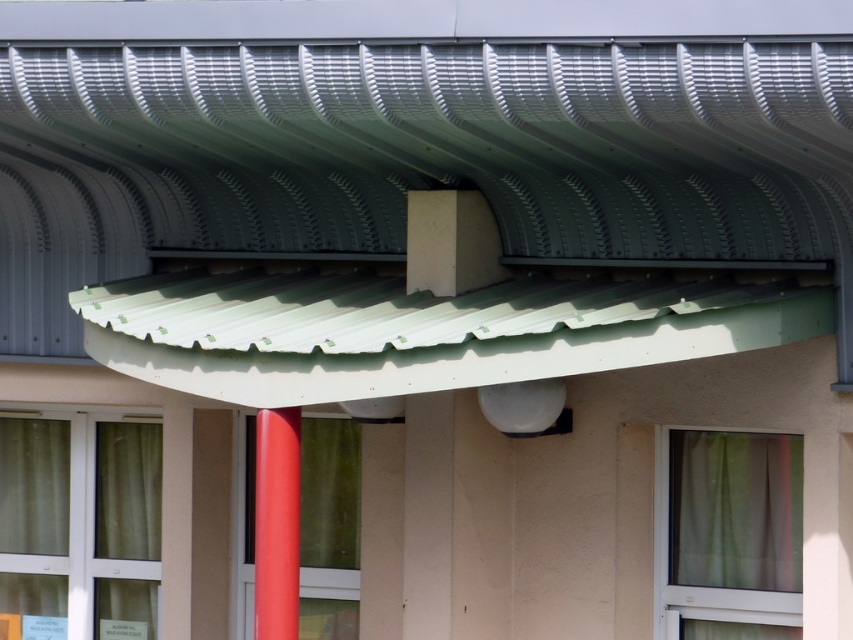
You are standing in front of a building and notice two green curtains. The green fabric curtain at lower left and the green sheer curtain at lower right. Which one reaches higher up the wall?

The green fabric curtain at lower left reaches higher up the wall than the green sheer curtain at lower right because it is taller.